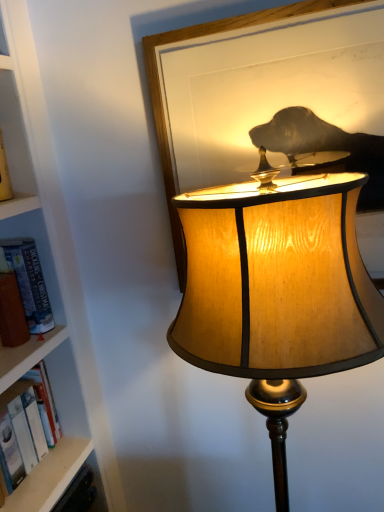
Question: From the image's perspective, relative to hardcover book at left, is wooden frame at upper center above or below?

Choices:
 (A) above
 (B) below

Answer: (A)

Question: In terms of size, does wooden frame at upper center appear bigger or smaller than hardcover book at left?

Choices:
 (A) big
 (B) small

Answer: (A)

Question: Which object is the closest to the wooden lampshade at center?

Choices:
 (A) hardcover book at left
 (B) wooden frame at upper center

Answer: (B)

Question: Estimate the real-world distances between objects in this image. Which object is closer to the hardcover book at left?

Choices:
 (A) wooden lampshade at center
 (B) wooden frame at upper center

Answer: (B)